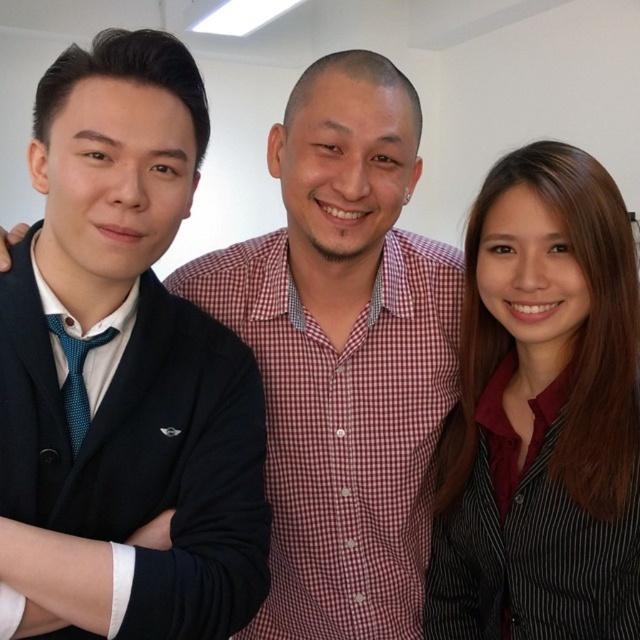
Question: Which point is farther to the camera?

Choices:
 (A) (128, 394)
 (B) (497, 531)

Answer: (B)

Question: Observing the image, what is the correct spatial positioning of black striped shirt at right in reference to matte black blazer at left?

Choices:
 (A) right
 (B) left

Answer: (A)

Question: Which point is closer to the camera?

Choices:
 (A) black striped shirt at right
 (B) matte black blazer at left

Answer: (B)

Question: Does black striped shirt at right appear on the right side of matte black blazer at left?

Choices:
 (A) no
 (B) yes

Answer: (B)

Question: Does black striped shirt at right appear on the left side of matte black blazer at left?

Choices:
 (A) no
 (B) yes

Answer: (A)